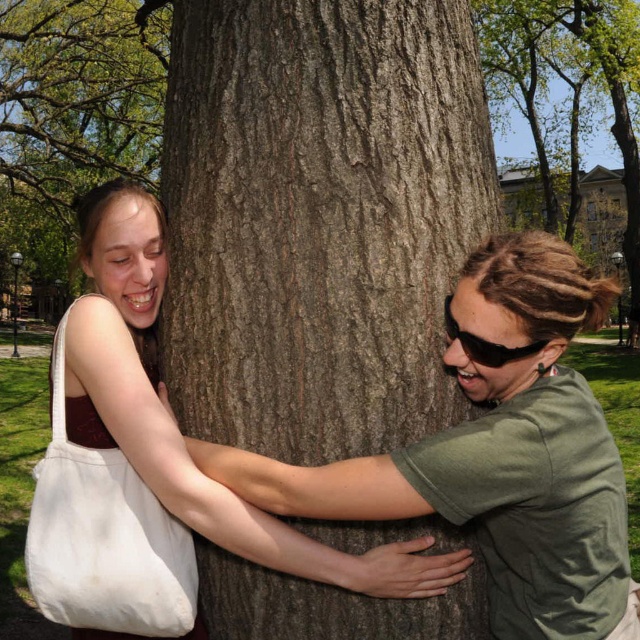
You are standing in the park and see the white canvas tote at left. Can you estimate its position relative to the tree trunk?

The white canvas tote at left is located at point 0.839 on the x axis and 0.163 on the y axis relative to the tree trunk.

You are a park ranger inspecting the park. You notice the smooth bark tree at center and the black plastic goggles at right. Based on their positions, can you determine if the tree is taller than the goggles?

The smooth bark tree at center is located above the black plastic goggles at right, which means the tree is taller than the goggles.

Consider the image. You are a delivery person who needs to place a 20 inch package between the brown rough tree trunk at center and the white canvas tote at left. Can the package fit in the space between them?

The distance between the brown rough tree trunk at center and the white canvas tote at left is 20.70 inches, so the 20 inch package can fit in the space between them.